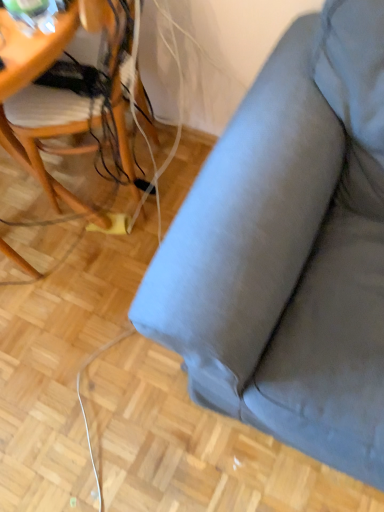
Identify the location of woodenchair at left. The height and width of the screenshot is (512, 384). (60, 100).

The height and width of the screenshot is (512, 384). What do you see at coordinates (60, 100) in the screenshot? I see `woodenchair at left` at bounding box center [60, 100].

What do you see at coordinates (289, 250) in the screenshot?
I see `matte gray fabric couch at upper right` at bounding box center [289, 250].

At what (x,y) coordinates should I click in order to perform the action: click on matte gray fabric couch at upper right. Please return your answer as a coordinate pair (x, y). Looking at the image, I should click on (289, 250).

In order to click on woodenchair at left in this screenshot , I will do pos(60,100).

Is woodenchair at left to the left or to the right of matte gray fabric couch at upper right in the image?

In the image, woodenchair at left appears on the left side of matte gray fabric couch at upper right.

Between woodenchair at left and matte gray fabric couch at upper right, which one is positioned behind?

woodenchair at left is further away from the camera.

Considering the points (6, 17) and (281, 348), which point is in front, point (6, 17) or point (281, 348)?

The point (6, 17) is in front.

Looking at this image, from the image's perspective, who appears lower, woodenchair at left or matte gray fabric couch at upper right?

matte gray fabric couch at upper right, from the image's perspective.

From a real-world perspective, is woodenchair at left positioned under matte gray fabric couch at upper right based on gravity?

Yes.

Between woodenchair at left and matte gray fabric couch at upper right, which one has larger width?

matte gray fabric couch at upper right is wider.

Looking at this image, which of these two, woodenchair at left or matte gray fabric couch at upper right, stands shorter?

With less height is woodenchair at left.

Is woodenchair at left smaller than matte gray fabric couch at upper right?

Correct, woodenchair at left occupies less space than matte gray fabric couch at upper right.

Choose the correct answer: Is woodenchair at left inside matte gray fabric couch at upper right or outside it?

The correct answer is: outside.

Are woodenchair at left and matte gray fabric couch at upper right located far from each other?

No, woodenchair at left is not far away from matte gray fabric couch at upper right.

Is woodenchair at left aimed at matte gray fabric couch at upper right?

No, woodenchair at left is not aimed at matte gray fabric couch at upper right.

Where is `chair below the matte gray fabric couch at upper right (from a real-world perspective)`? Image resolution: width=384 pixels, height=512 pixels. chair below the matte gray fabric couch at upper right (from a real-world perspective) is located at coordinates (60, 100).

Which is more to the left, matte gray fabric couch at upper right or woodenchair at left?

Positioned to the left is woodenchair at left.

Is matte gray fabric couch at upper right positioned before woodenchair at left?

Yes.

Considering the points (330, 311) and (61, 105), which point is in front, point (330, 311) or point (61, 105)?

The point (330, 311) is more forward.

From the image's perspective, who appears lower, matte gray fabric couch at upper right or woodenchair at left?

matte gray fabric couch at upper right appears lower in the image.

From a real-world perspective, which object stands above the other?

matte gray fabric couch at upper right.

Can you confirm if matte gray fabric couch at upper right is thinner than woodenchair at left?

No, matte gray fabric couch at upper right is not thinner than woodenchair at left.

Does matte gray fabric couch at upper right have a greater height compared to woodenchair at left?

Yes.

Considering the sizes of objects matte gray fabric couch at upper right and woodenchair at left in the image provided, who is smaller, matte gray fabric couch at upper right or woodenchair at left?

woodenchair at left.

Choose the correct answer: Is matte gray fabric couch at upper right inside woodenchair at left or outside it?

matte gray fabric couch at upper right is located beyond the bounds of woodenchair at left.

Would you consider matte gray fabric couch at upper right to be distant from woodenchair at left?

Actually, matte gray fabric couch at upper right and woodenchair at left are a little close together.

Could you tell me if matte gray fabric couch at upper right is facing woodenchair at left?

No, matte gray fabric couch at upper right is not turned towards woodenchair at left.

Measure the distance from matte gray fabric couch at upper right to woodenchair at left.

They are 23.57 inches apart.

This screenshot has width=384, height=512. In order to click on chair that is behind the matte gray fabric couch at upper right in this screenshot , I will do `click(60, 100)`.

Locate an element on the screen. The image size is (384, 512). chair that appears behind the matte gray fabric couch at upper right is located at coordinates (60, 100).

Where is `chair lying on the left of matte gray fabric couch at upper right`? This screenshot has width=384, height=512. chair lying on the left of matte gray fabric couch at upper right is located at coordinates (60, 100).